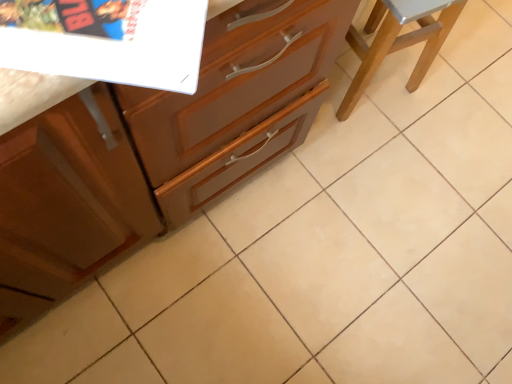
Locate an element on the screen. The height and width of the screenshot is (384, 512). free space above wooden cabinet at center (from a real-world perspective) is located at coordinates (353, 216).